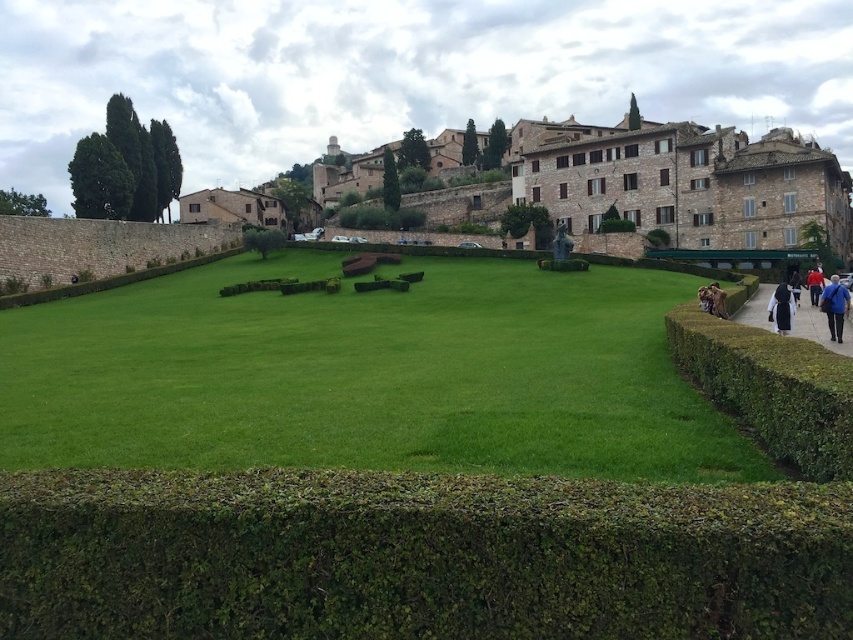
You are a gardener who wants to place a new decorative item between the green leafy hedge at right and the black cloth at lower right. Which object should you place it closer to if you want it to be near the smaller object?

You should place the decorative item closer to the green leafy hedge at right because it has a smaller size compared to the black cloth at lower right.

You are standing at point (786,284) and want to walk to point (807,438). Based on the scene description, which direction should you move relative to your current position?

You should move forward because point (807,438) is in front of point (786,284) according to the scene description.

Consider the image. You are a photographer standing at the center of the lawn with the green leafy hedge at right and the blue fabric jacket at lower right in your view. Which object is taller when viewed from your position?

The green leafy hedge at right is taller than the blue fabric jacket at lower right.